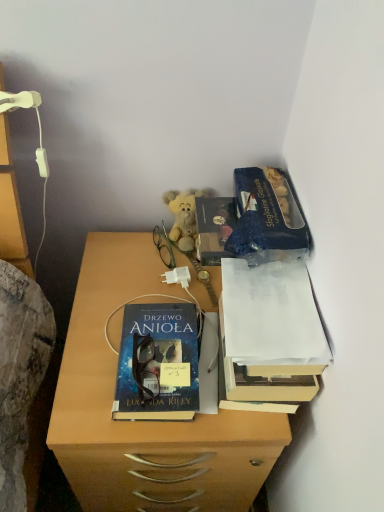
Question: Is white paper at upper right, which ranks as the 1th book in right-to-left order, touching green plastic glasses at center?

Choices:
 (A) yes
 (B) no

Answer: (B)

Question: Is green plastic glasses at center inside white paper at upper right, acting as the 2th book starting from the left?

Choices:
 (A) yes
 (B) no

Answer: (B)

Question: Considering the relative sizes of white paper at upper right, acting as the 2th book starting from the left, and green plastic glasses at center in the image provided, is white paper at upper right, acting as the 2th book starting from the left, wider than green plastic glasses at center?

Choices:
 (A) yes
 (B) no

Answer: (A)

Question: Considering the relative sizes of white paper at upper right, which ranks as the 1th book in right-to-left order, and green plastic glasses at center in the image provided, is white paper at upper right, which ranks as the 1th book in right-to-left order, taller than green plastic glasses at center?

Choices:
 (A) no
 (B) yes

Answer: (B)

Question: From the image's perspective, would you say white paper at upper right, acting as the 2th book starting from the left, is shown under green plastic glasses at center?

Choices:
 (A) yes
 (B) no

Answer: (A)

Question: Is white paper at upper right, which ranks as the 1th book in right-to-left order, oriented towards green plastic glasses at center?

Choices:
 (A) no
 (B) yes

Answer: (A)

Question: From a real-world perspective, is blue glossy book at center, the first book viewed from the left, under soft yellow plush at center?

Choices:
 (A) no
 (B) yes

Answer: (B)

Question: Does blue glossy book at center, which is counted as the 2th book, starting from the right, have a lesser width compared to soft yellow plush at center?

Choices:
 (A) yes
 (B) no

Answer: (B)

Question: Considering the relative sizes of blue glossy book at center, which is counted as the 2th book, starting from the right, and soft yellow plush at center in the image provided, is blue glossy book at center, which is counted as the 2th book, starting from the right, shorter than soft yellow plush at center?

Choices:
 (A) yes
 (B) no

Answer: (A)

Question: Is blue glossy book at center, which is counted as the 2th book, starting from the right, at the right side of soft yellow plush at center?

Choices:
 (A) no
 (B) yes

Answer: (A)

Question: From the image's perspective, is blue glossy book at center, which is counted as the 2th book, starting from the right, below soft yellow plush at center?

Choices:
 (A) yes
 (B) no

Answer: (A)

Question: Does blue glossy book at center, the first book viewed from the left, turn towards soft yellow plush at center?

Choices:
 (A) yes
 (B) no

Answer: (B)

Question: Is matte wooden desk at center positioned beyond the bounds of green plastic glasses at center?

Choices:
 (A) no
 (B) yes

Answer: (B)